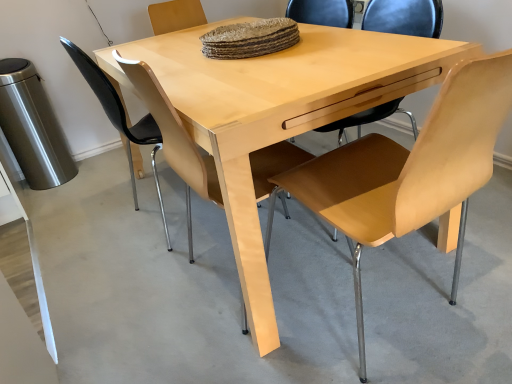
The width and height of the screenshot is (512, 384). I want to click on vacant area situated to the left side of light wood chair at center, the second chair in the left-to-right sequence, so click(136, 306).